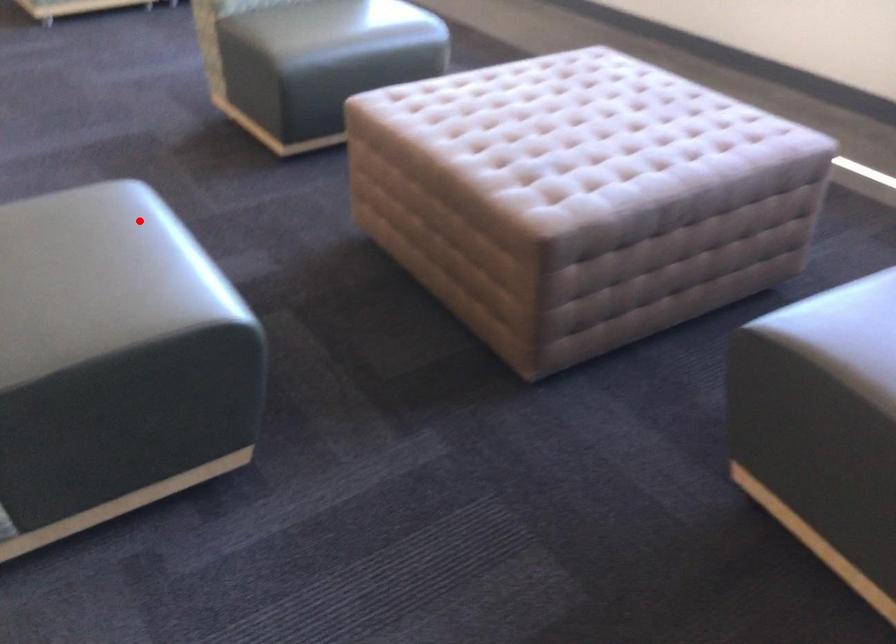
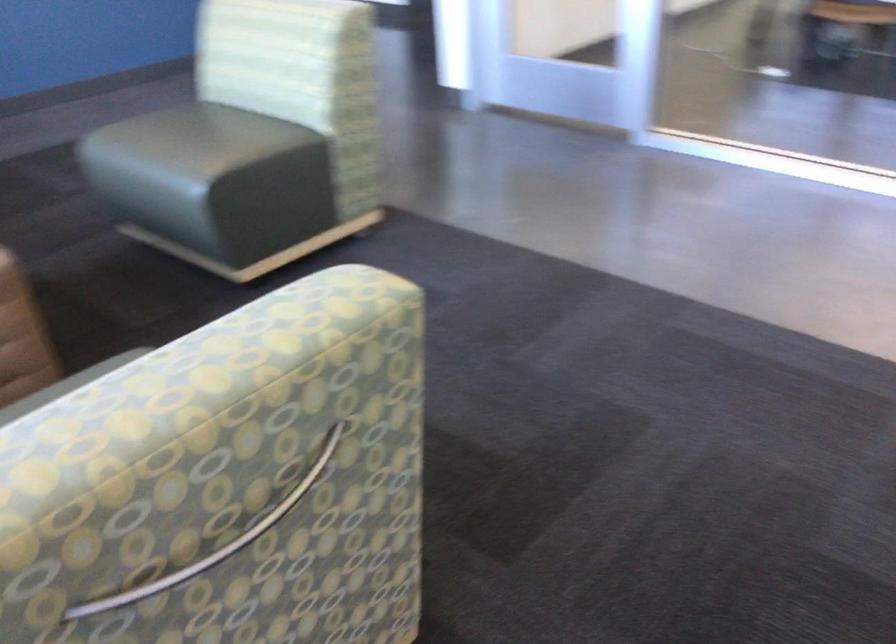
Question: I am providing you with two images of the same scene from different viewpoints. In image1, a red point is highlighted. Considering the same 3D point in image2, which of the following is correct?

Choices:
 (A) It is closer
 (B) It is farther

Answer: (B)